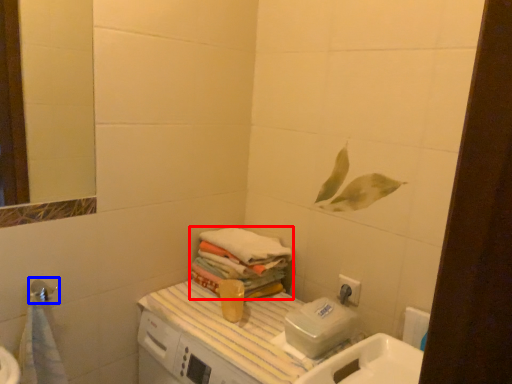
Question: Which object appears closest to the camera in this image, bath towel (highlighted by a red box) or shower (highlighted by a blue box)?

Choices:
 (A) bath towel
 (B) shower

Answer: (B)